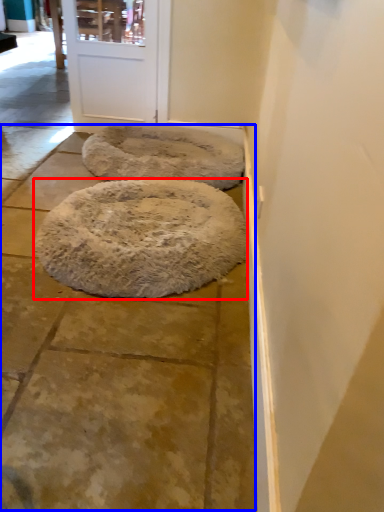
Question: Which object is further to the camera taking this photo, dog bed (highlighted by a red box) or pavement (highlighted by a blue box)?

Choices:
 (A) dog bed
 (B) pavement

Answer: (A)